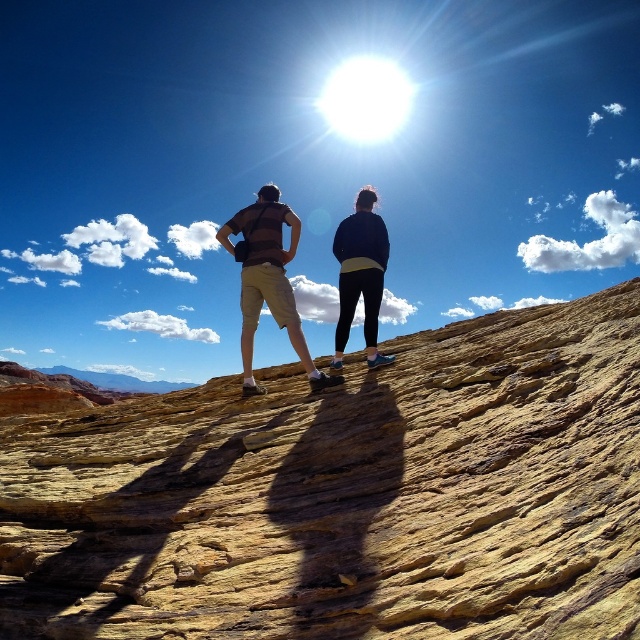
You are planning to place a small picnic basket between the yellow sandstone at center and the dark blue fleece jacket at center. Based on their sizes, which object should you place the basket closer to to ensure it fits comfortably?

The yellow sandstone at center is wider than the dark blue fleece jacket at center, so placing the picnic basket closer to the yellow sandstone at center would provide more space for it to fit comfortably.